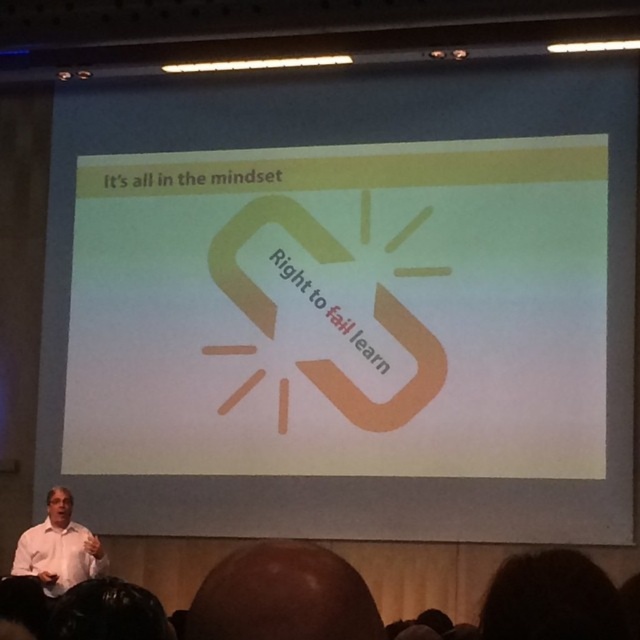
Question: Which object appears closest to the camera in this image?

Choices:
 (A) white shirt at lower left
 (B) smooth bald head at lower center

Answer: (B)

Question: Can you confirm if smooth bald head at lower center is positioned above white shirt at lower left?

Choices:
 (A) yes
 (B) no

Answer: (A)

Question: Which object appears farthest from the camera in this image?

Choices:
 (A) white matte projection screen at center
 (B) white shirt at lower left
 (C) smooth bald head at lower center

Answer: (A)

Question: Where is white matte projection screen at center located in relation to white shirt at lower left in the image?

Choices:
 (A) right
 (B) left

Answer: (A)

Question: Which point is closer to the camera?

Choices:
 (A) (356, 634)
 (B) (618, 282)

Answer: (A)

Question: In this image, where is white matte projection screen at center located relative to smooth bald head at lower center?

Choices:
 (A) below
 (B) above

Answer: (B)